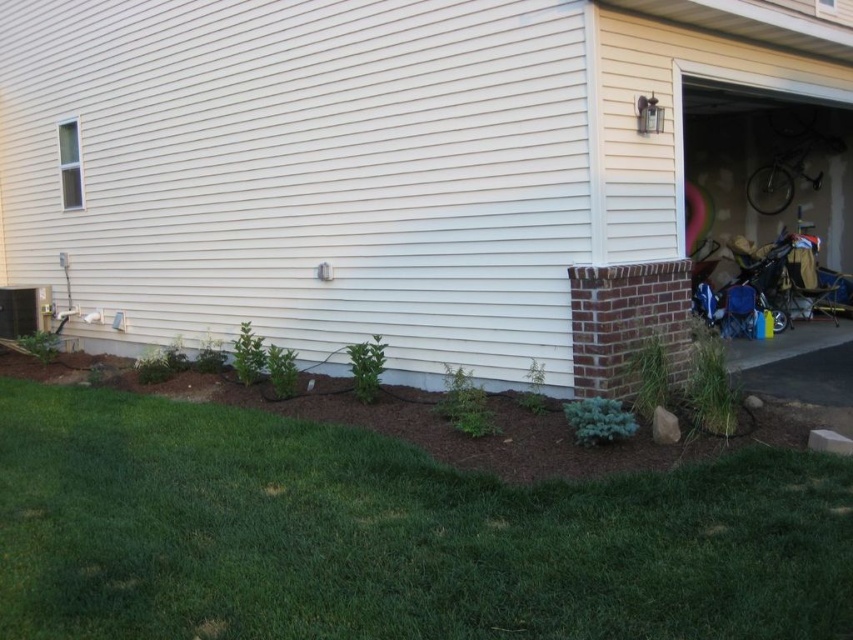
You are a delivery person arriving at this residential property. You need to park your vehicle in the matte white garage at center. However, there is green grass at lower left in your path. Based on their positions, can you drive directly to the garage without crossing the grass?

The matte white garage at center is to the left of green grass at lower left, so you can drive directly to the matte white garage at center without crossing the green grass at lower left.

You are a painter who needs to assess the height difference between the matte white garage at center and the green grass at lower left for a project. Which object is taller?

The matte white garage at center is taller than the green grass at lower left.

You are a gardener planning to water the green grass at lower left using the black garden hose. The matte white garage at center is in the way. Can you move the hose around the garage to reach the grass?

The matte white garage at center is located above green grass at lower left, so the garage is positioned higher up relative to the grass. Since the garage is above, you can move the hose around the sides or behind the garage to reach the green grass at lower left.